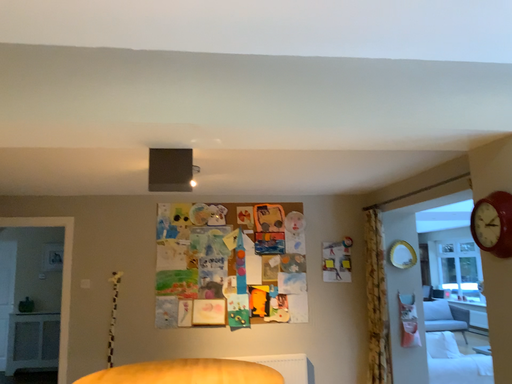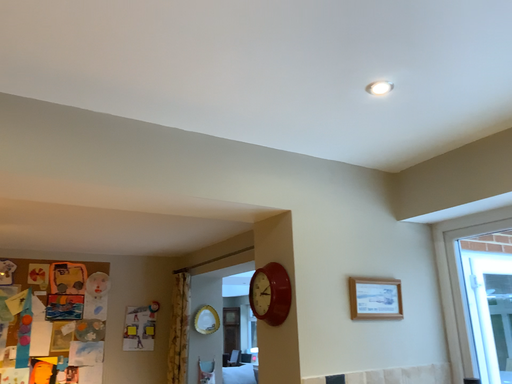
Question: Which way did the camera rotate in the video?

Choices:
 (A) rotated downward
 (B) rotated upward

Answer: (B)